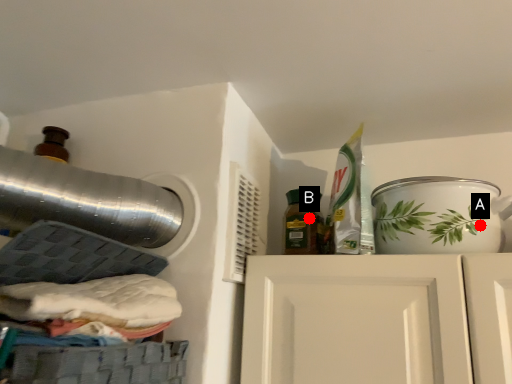
Question: Two points are circled on the image, labeled by A and B beside each circle. Which point is closer to the camera?

Choices:
 (A) A is closer
 (B) B is closer

Answer: (A)